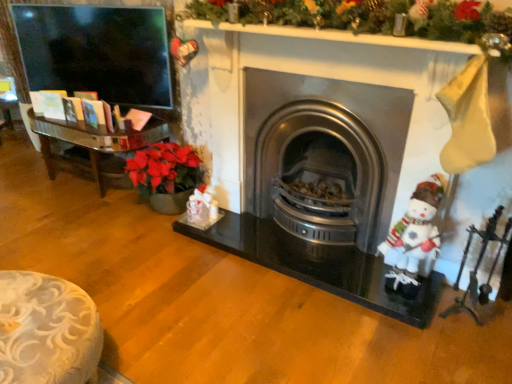
Locate an element on the screen. The width and height of the screenshot is (512, 384). vacant area located to the right-hand side of white fabric santa claus at right is located at coordinates (440, 293).